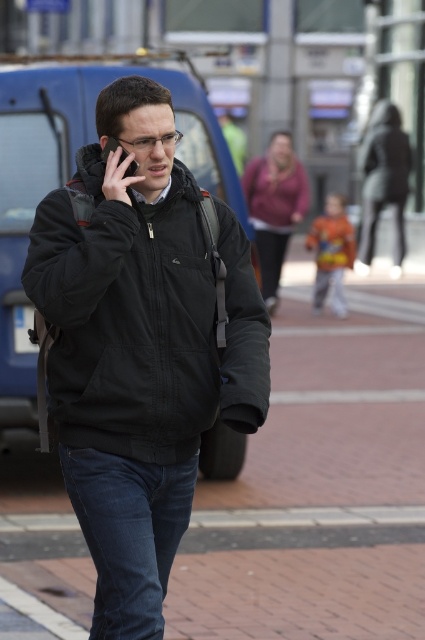
Question: Can you confirm if dark blue denim jeans at lower center is bigger than black matte ear at upper center?

Choices:
 (A) yes
 (B) no

Answer: (A)

Question: Which of the following is the closest to the observer?

Choices:
 (A) black matte ear at upper center
 (B) dark blue denim jeans at lower center
 (C) black matte jacket at center
 (D) black matte smartphone at upper left

Answer: (B)

Question: Observing the image, what is the correct spatial positioning of black matte jacket at center in reference to black matte smartphone at upper left?

Choices:
 (A) above
 (B) below

Answer: (B)

Question: Estimate the real-world distances between objects in this image. Which object is closer to the black matte jacket at center?

Choices:
 (A) dark blue denim jeans at lower center
 (B) black matte smartphone at upper left
 (C) black matte ear at upper center

Answer: (A)

Question: Among these objects, which one is nearest to the camera?

Choices:
 (A) black matte smartphone at upper left
 (B) dark blue denim jeans at lower center

Answer: (B)

Question: Is dark blue denim jeans at lower center further to the viewer compared to black matte smartphone at upper left?

Choices:
 (A) no
 (B) yes

Answer: (A)